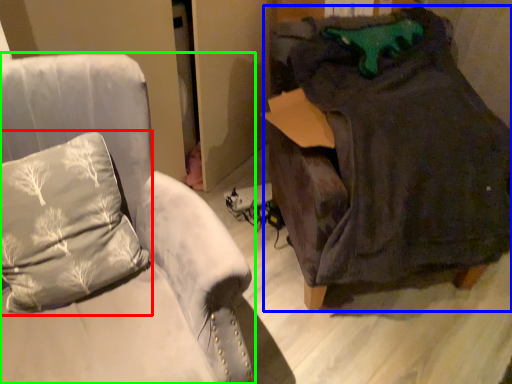
Question: Based on their relative distances, which object is farther from pillow (highlighted by a red box)? Choose from bean bag chair (highlighted by a blue box) and furniture (highlighted by a green box).

Choices:
 (A) bean bag chair
 (B) furniture

Answer: (A)